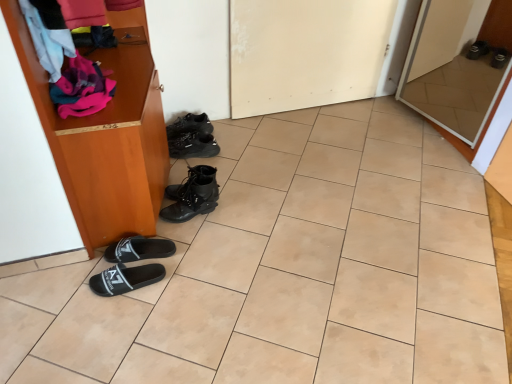
You are a GUI agent. You are given a task and a screenshot of the screen. Output one action in this format:
    pyautogui.click(x=<x>, y=<y>)
    Task: Click on the vacant area that lies between black fabric slipper at lower left, which is the second footwear from bottom to top, and white glossy door at upper right, the 1th door in the right-to-left sequence
    
    Given the screenshot: What is the action you would take?
    pyautogui.click(x=323, y=177)